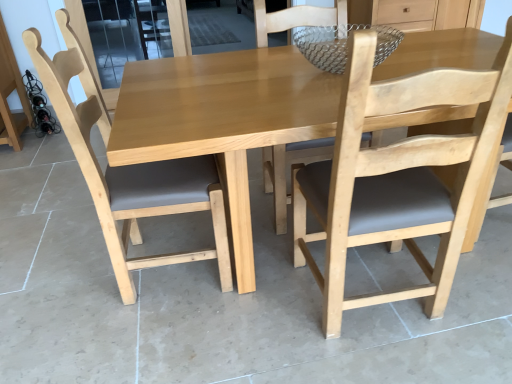
Question: From the image's perspective, relative to black matte wine bottles at left, is light brown wood chair at center, placed as the first chair when sorted from left to right, above or below?

Choices:
 (A) below
 (B) above

Answer: (A)

Question: Looking at the image, does light brown wood chair at center, acting as the 2th chair starting from the right, seem bigger or smaller compared to black matte wine bottles at left?

Choices:
 (A) big
 (B) small

Answer: (A)

Question: Which of these objects is positioned closest to the light brown wood chair at center, placed as the first chair when sorted from left to right?

Choices:
 (A) light brown wood chair at center, which ranks as the 1th chair in right-to-left order
 (B) black matte wine bottles at left
 (C) natural wood table at center

Answer: (C)

Question: Which is nearer to the light brown wood chair at center, which ranks as the 1th chair in right-to-left order?

Choices:
 (A) black matte wine bottles at left
 (B) light brown wood chair at center, acting as the 2th chair starting from the right
 (C) natural wood table at center

Answer: (C)